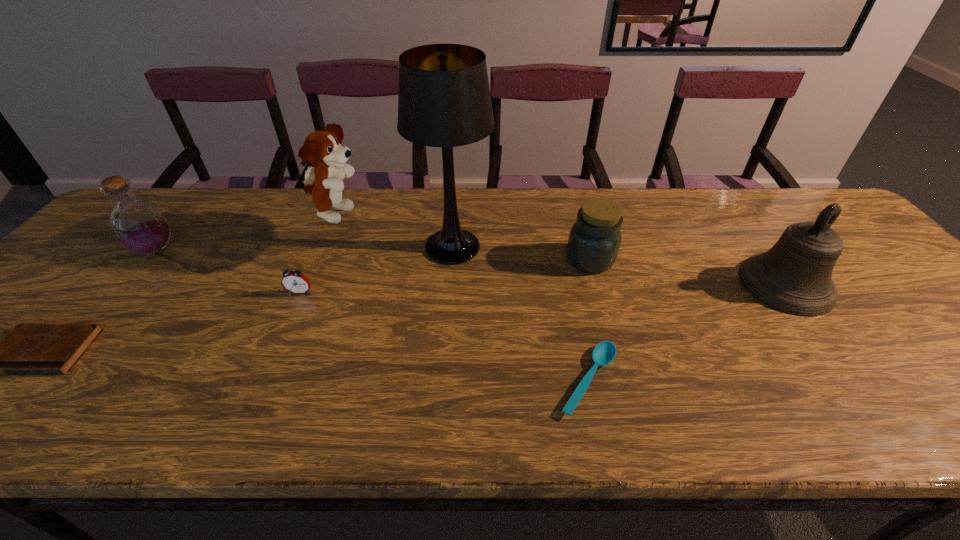
This screenshot has height=540, width=960. Identify the location of vacant area situated 0.330m on the left of the bell. (611, 284).

The image size is (960, 540). Identify the location of blank space located 0.360m on the front of the bottle. [x=44, y=383].

Locate an element on the screen. The image size is (960, 540). vacant region located on the front of the jar is located at coordinates (618, 359).

The width and height of the screenshot is (960, 540). In order to click on vacant point located on the clock face of the alarm clock in this screenshot , I will do `click(288, 322)`.

Where is `free space located 0.060m on the left of the shortest object`? Image resolution: width=960 pixels, height=540 pixels. free space located 0.060m on the left of the shortest object is located at coordinates click(x=527, y=381).

Image resolution: width=960 pixels, height=540 pixels. Identify the location of table lamp present at the far edge. (444, 100).

Locate an element on the screen. puppy that is at the far edge is located at coordinates (322, 149).

Find the location of a particular element. The image size is (960, 540). object present at the near edge is located at coordinates (603, 354).

Image resolution: width=960 pixels, height=540 pixels. Find the location of `object that is positioned at the left edge`. object that is positioned at the left edge is located at coordinates (138, 225).

This screenshot has width=960, height=540. In the image, there is a desktop. Find the location of `free space at the far edge`. free space at the far edge is located at coordinates (427, 194).